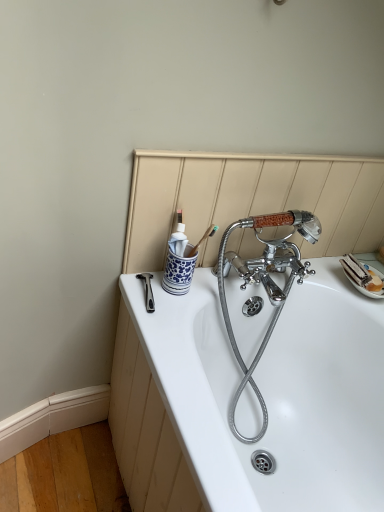
Describe the element at coordinates (275, 393) in the screenshot. I see `white ceramic bathtub at center` at that location.

Where is `white ceramic bathtub at center`? The image size is (384, 512). white ceramic bathtub at center is located at coordinates (275, 393).

What is the approximate height of white ceramic bathtub at center?

The height of white ceramic bathtub at center is 24.97 inches.

This screenshot has width=384, height=512. In order to click on white ceramic bathtub at center in this screenshot , I will do `click(275, 393)`.